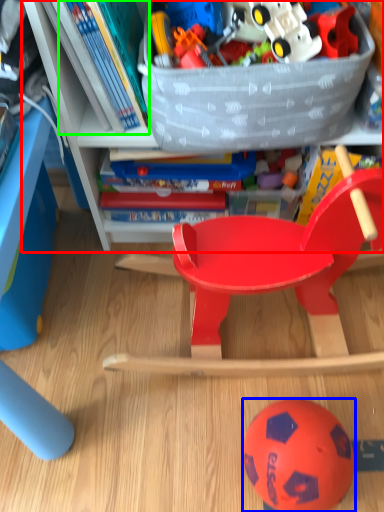
Question: Based on their relative distances, which object is nearer to bookcase (highlighted by a red box)? Choose from ball (highlighted by a blue box) and book (highlighted by a green box).

Choices:
 (A) ball
 (B) book

Answer: (B)